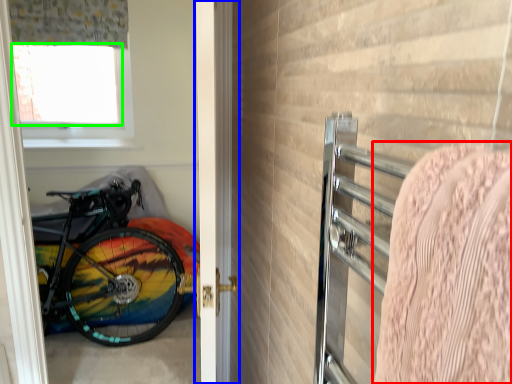
Question: Which is farther away from blanket (highlighted by a red box)? door (highlighted by a blue box) or window screen (highlighted by a green box)?

Choices:
 (A) door
 (B) window screen

Answer: (B)